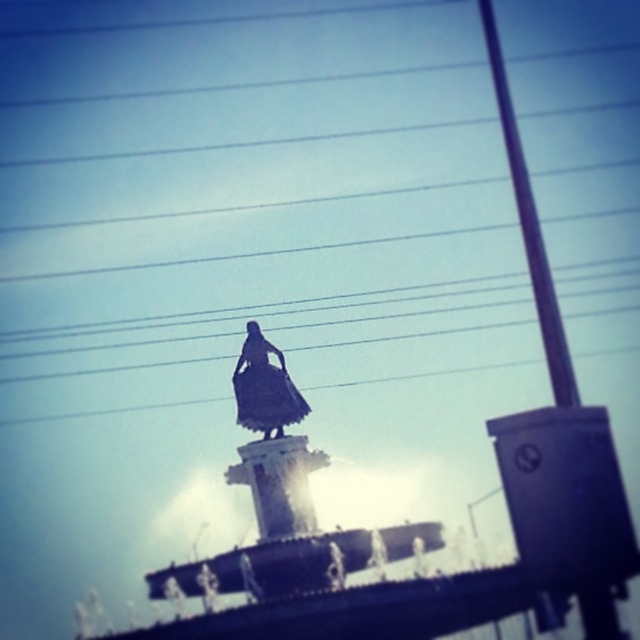
Which is below, metallic pole at right or black matte dress at center?

black matte dress at center is lower down.

Does metallic pole at right have a greater height compared to black matte dress at center?

Indeed, metallic pole at right has a greater height compared to black matte dress at center.

I want to click on metallic pole at right, so click(x=531, y=228).